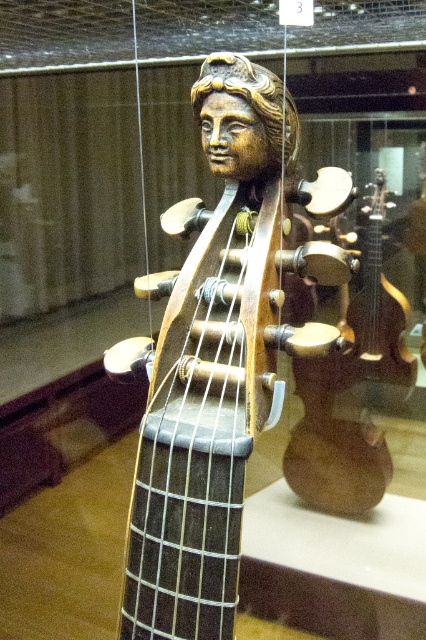
You are a museum curator planning to display the wooden carved head at center and the shiny gold guitar at center in a new exhibition. Which object should you place closer to the entrance to ensure visitors notice its larger size first?

The wooden carved head at center has a larger size compared to the shiny gold guitar at center. To ensure visitors notice its larger size first, place the wooden carved head at center closer to the entrance.